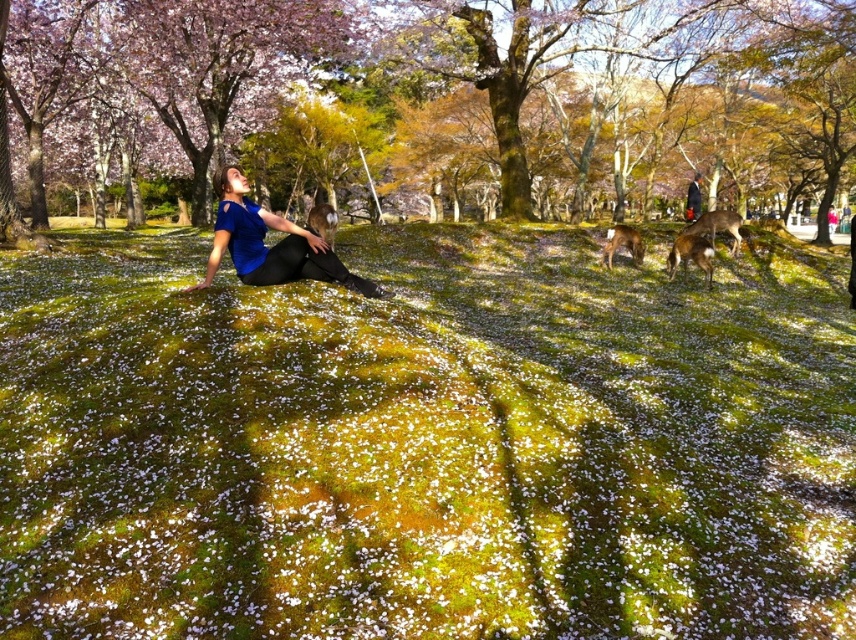
Who is lower down, white matte petals at center or smooth bark tree at upper center?

white matte petals at center is below.

Does white matte petals at center come in front of smooth bark tree at upper center?

Yes, it is.

Who is more distant from viewer, (583, 314) or (619, 141)?

Point (619, 141)

I want to click on white matte petals at center, so click(425, 442).

Who is shorter, white matte petals at center or brown furry deer at center?

Standing shorter between the two is brown furry deer at center.

Does white matte petals at center have a greater width compared to brown furry deer at center?

Yes.

Who is more distant from viewer, (x=280, y=554) or (x=627, y=244)?

Positioned behind is point (x=627, y=244).

At what (x,y) coordinates should I click in order to perform the action: click on white matte petals at center. Please return your answer as a coordinate pair (x, y). The width and height of the screenshot is (856, 640). Looking at the image, I should click on (425, 442).

Is brown furry deer at center-right to the left of brown furry deer at right from the viewer's perspective?

Yes, brown furry deer at center-right is to the left of brown furry deer at right.

Is point (706, 288) farther from camera compared to point (717, 228)?

No, it is in front of (717, 228).

Describe the element at coordinates (690, 256) in the screenshot. I see `brown furry deer at center-right` at that location.

Locate an element on the screen. The width and height of the screenshot is (856, 640). brown furry deer at center-right is located at coordinates (690, 256).